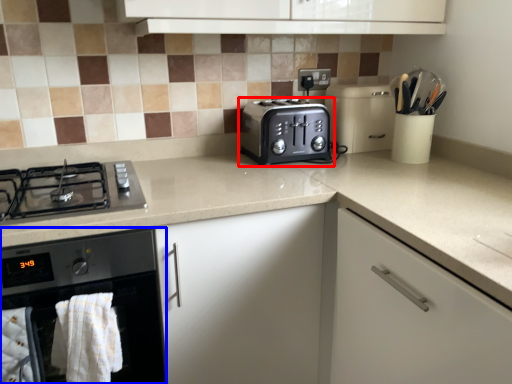
Question: Which of the following is the closest to the observer, toaster (highlighted by a red box) or home appliance (highlighted by a blue box)?

Choices:
 (A) toaster
 (B) home appliance

Answer: (B)